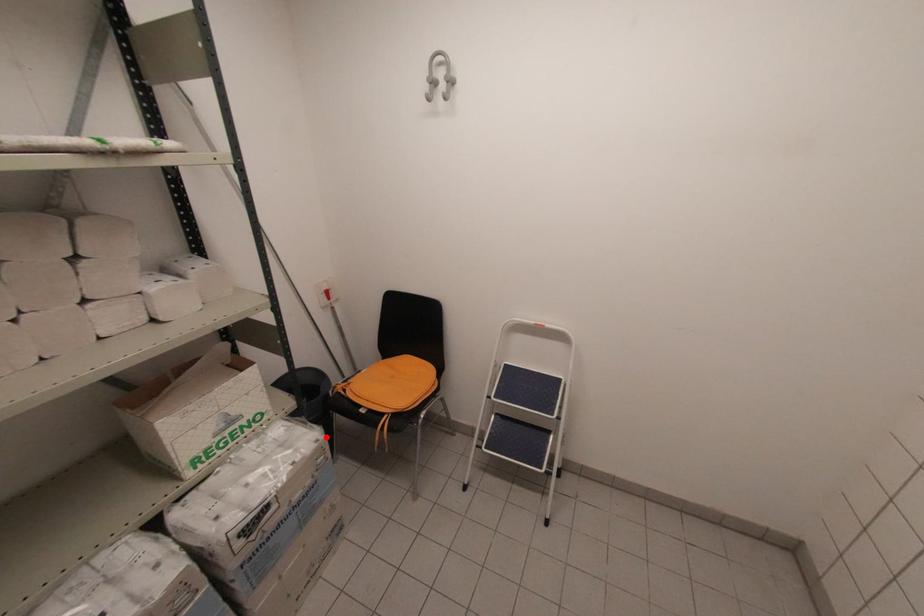
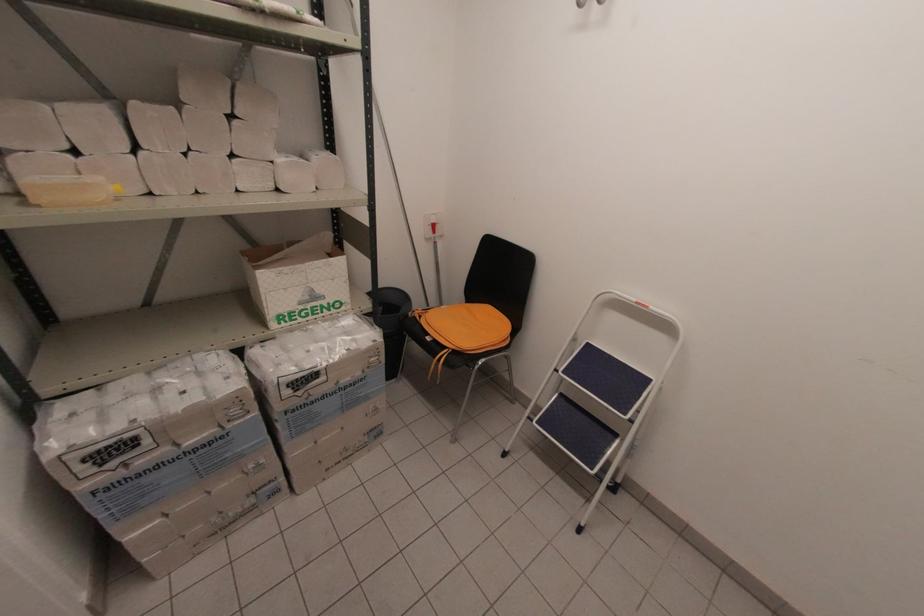
Question: I am providing you with two images of the same scene from different viewpoints. A red point is shown in image1. For the corresponding object point in image2, is it positioned nearer or farther from the camera?

Choices:
 (A) Nearer
 (B) Farther

Answer: (B)